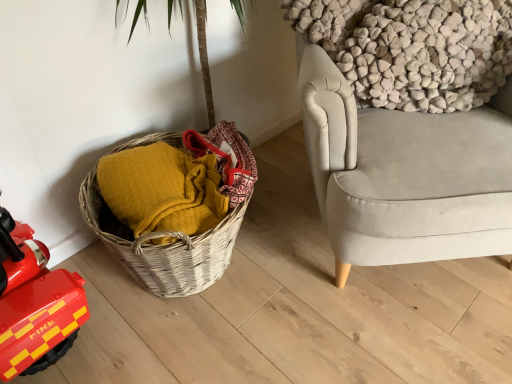
What are the coordinates of `red plastic toy at lower left` in the screenshot? It's located at (34, 303).

What do you see at coordinates (34, 303) in the screenshot?
I see `red plastic toy at lower left` at bounding box center [34, 303].

Where is `red plastic toy at lower left`? The width and height of the screenshot is (512, 384). red plastic toy at lower left is located at coordinates (34, 303).